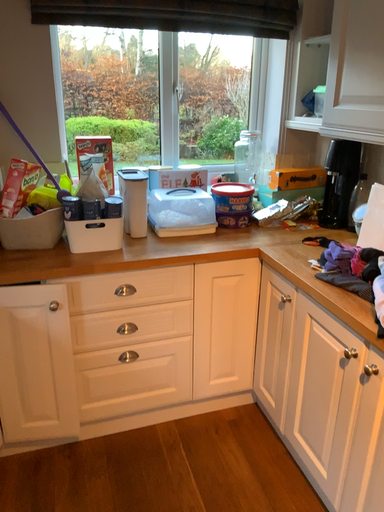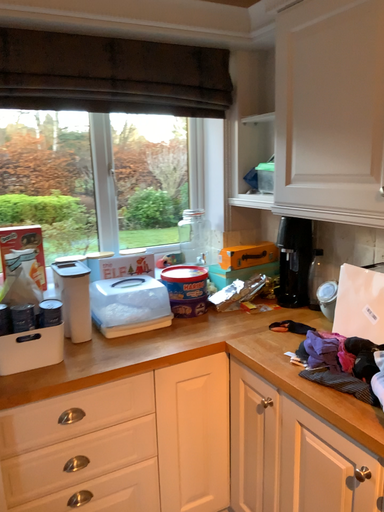
Question: Which way did the camera rotate in the video?

Choices:
 (A) rotated left
 (B) rotated right

Answer: (B)